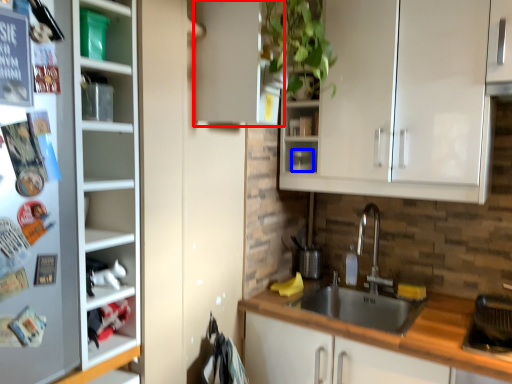
Question: Among these objects, which one is nearest to the camera, cabinetry (highlighted by a red box) or appliance (highlighted by a blue box)?

Choices:
 (A) cabinetry
 (B) appliance

Answer: (A)